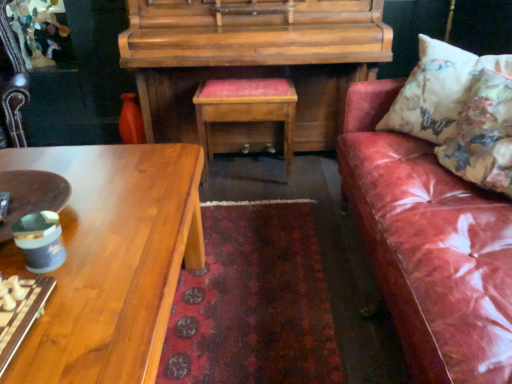
What are the coordinates of `free space above woodenwoodentable at center (from a real-world perspective)` in the screenshot? It's located at (257, 87).